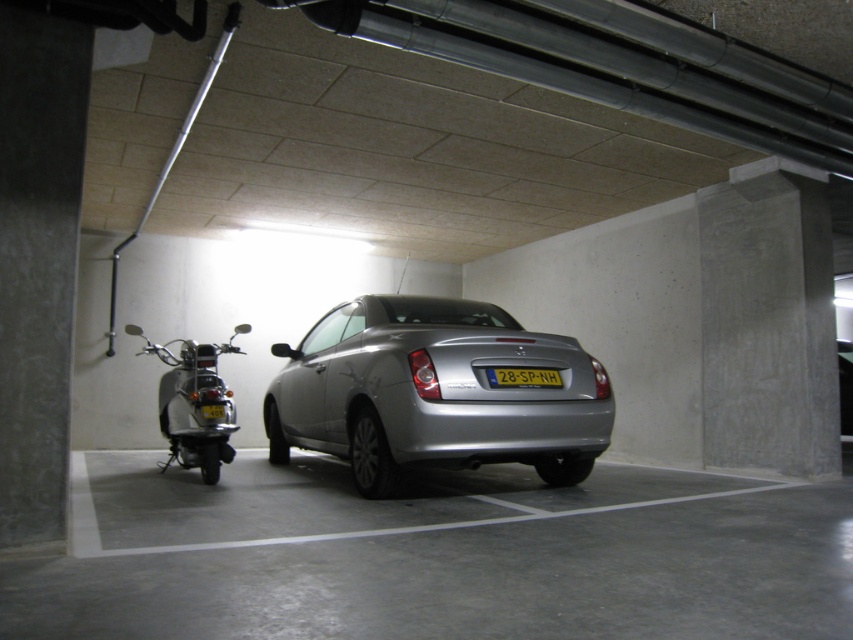
You are driving a car and want to park in the parking garage. You see a silver metallic car at center and a shiny chrome scooter at left. Which vehicle is closer to you?

The silver metallic car at center is closer to the viewer than the shiny chrome scooter at left.

Looking at this image, you are a delivery person who needs to park your shiny chrome scooter at left near the yellow plastic license plate at center. Based on the scene, can you safely park your scooter there without blocking the parking space of the silver sedan?

The shiny chrome scooter at left is already positioned to the left of the yellow plastic license plate at center, so parking it there would not obstruct the silver sedan as it is placed outside the designated parking space marked by white lines.